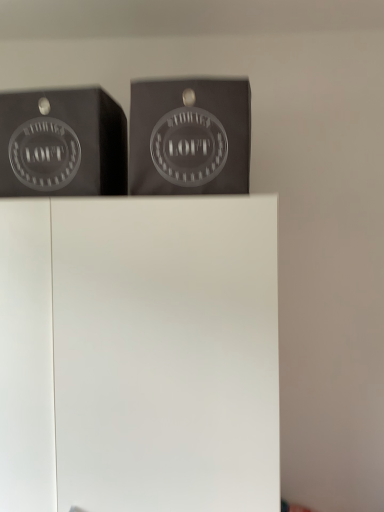
Question: Based on their positions, is matte black box at upper center located to the left or right of matte black logo at upper left?

Choices:
 (A) right
 (B) left

Answer: (A)

Question: Considering the positions of matte black box at upper center and matte black logo at upper left in the image, is matte black box at upper center taller or shorter than matte black logo at upper left?

Choices:
 (A) tall
 (B) short

Answer: (A)

Question: Which object is the closest to the matte black box at upper center?

Choices:
 (A) white matte cabinet at center
 (B) matte black logo at upper left

Answer: (B)

Question: Estimate the real-world distances between objects in this image. Which object is closer to the matte black box at upper center?

Choices:
 (A) matte black logo at upper left
 (B) white matte cabinet at center

Answer: (A)